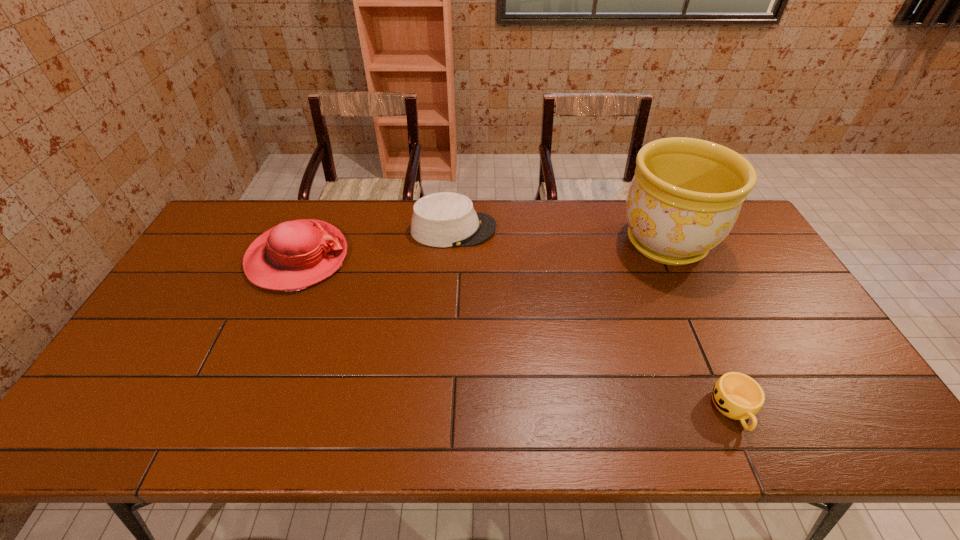
Identify which object is located as the second nearest to the second tallest object. Please provide its 2D coordinates. Your answer should be formatted as a tuple, i.e. [(x, y)], where the tuple contains the x and y coordinates of a point satisfying the conditions above.

[(686, 195)]

Locate an element on the screen. Image resolution: width=960 pixels, height=540 pixels. free location that satisfies the following two spatial constraints: 1. on the front side of the tallest object; 2. at the front of the third shortest object with a bow is located at coordinates (673, 258).

The width and height of the screenshot is (960, 540). What are the coordinates of `vacant region that satisfies the following two spatial constraints: 1. on the front-facing side of the cup; 2. on the left side of the right hat` in the screenshot? It's located at (442, 409).

Identify the location of free space that satisfies the following two spatial constraints: 1. on the front-facing side of the tallest object; 2. on the left side of the second object from left to right. (452, 243).

This screenshot has height=540, width=960. Find the location of `vacant position in the image that satisfies the following two spatial constraints: 1. at the front of the taller hat with a bow; 2. on the left side of the cup`. vacant position in the image that satisfies the following two spatial constraints: 1. at the front of the taller hat with a bow; 2. on the left side of the cup is located at coordinates (232, 409).

Locate an element on the screen. vacant space that satisfies the following two spatial constraints: 1. on the back side of the nearest object; 2. on the front-facing side of the second shortest object is located at coordinates (655, 230).

This screenshot has height=540, width=960. What are the coordinates of `vacant space that satisfies the following two spatial constraints: 1. on the back side of the flowerpot; 2. on the front-facing side of the right hat` in the screenshot? It's located at (660, 230).

Find the location of `free location that satisfies the following two spatial constraints: 1. at the front of the shortest object with a bow; 2. on the left side of the leftmost object`. free location that satisfies the following two spatial constraints: 1. at the front of the shortest object with a bow; 2. on the left side of the leftmost object is located at coordinates (232, 409).